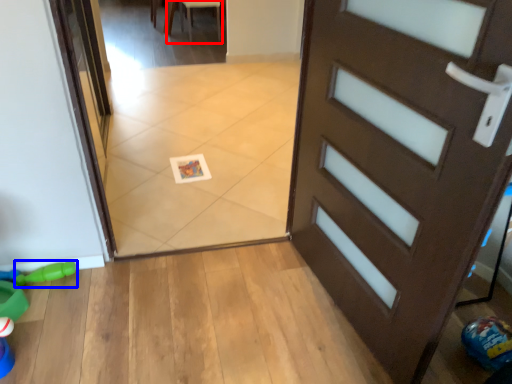
Question: Which object appears farthest to the camera in this image, chair (highlighted by a red box) or toy (highlighted by a blue box)?

Choices:
 (A) chair
 (B) toy

Answer: (A)